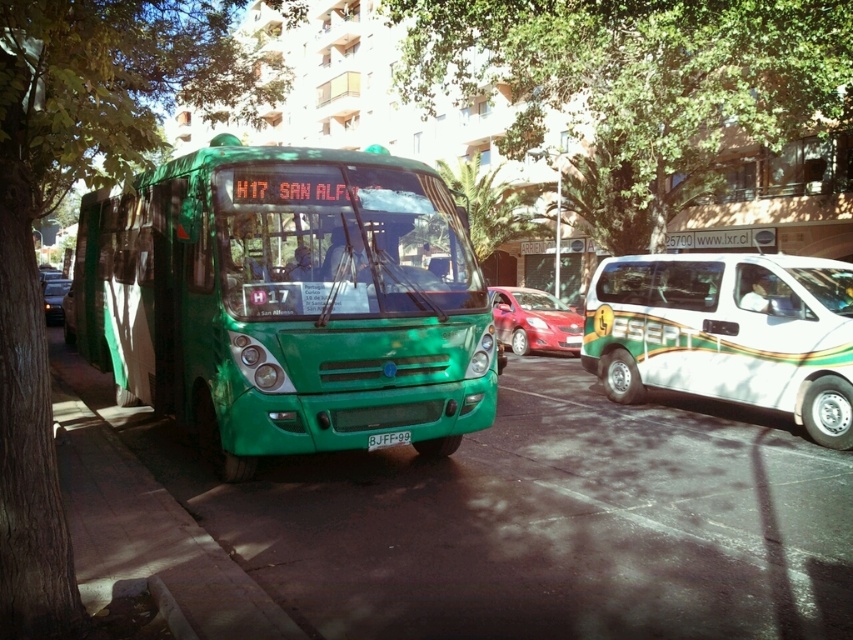
Question: Considering the relative positions of white glossy van at right and black plastic license plate at center in the image provided, where is white glossy van at right located with respect to black plastic license plate at center?

Choices:
 (A) left
 (B) right

Answer: (B)

Question: Is green matte bus at center smaller than shiny red sedan at center?

Choices:
 (A) no
 (B) yes

Answer: (B)

Question: Among these objects, which one is farthest from the camera?

Choices:
 (A) green leafy tree at upper center
 (B) shiny black car at center
 (C) white glossy van at right

Answer: (B)

Question: Which is farther from the shiny black car at center?

Choices:
 (A) green leafy tree at upper center
 (B) green matte bus at center
 (C) white glossy van at right
 (D) black plastic license plate at center

Answer: (C)

Question: Which point is closer to the camera?

Choices:
 (A) green matte bus at center
 (B) black plastic license plate at center
 (C) green leafy tree at upper center
 (D) white glossy van at right

Answer: (A)

Question: Is green leafy tree at left above black plastic license plate at center?

Choices:
 (A) no
 (B) yes

Answer: (B)